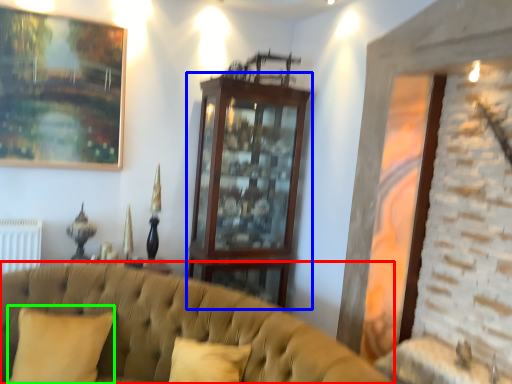
Question: Which object is positioned farthest from studio couch (highlighted by a red box)? Select from dresser (highlighted by a blue box) and pillow (highlighted by a green box).

Choices:
 (A) dresser
 (B) pillow

Answer: (A)